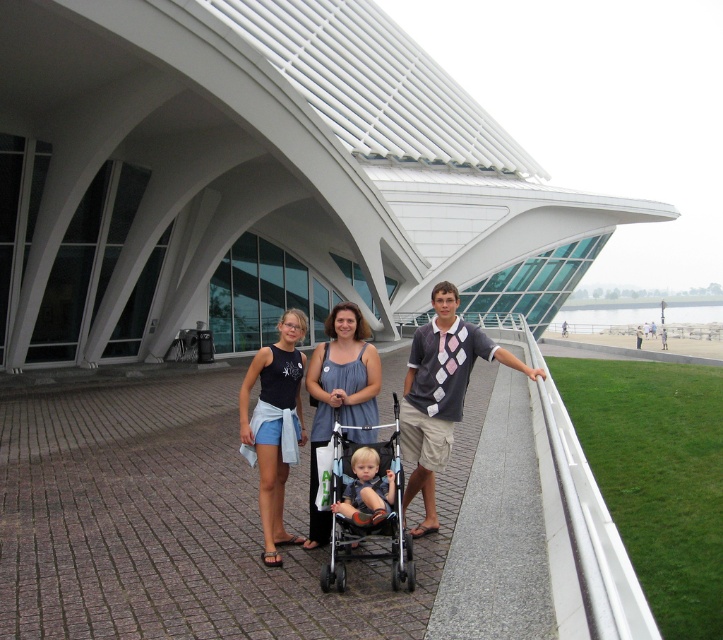
Is argyle-patterned shirt at center to the right of light brown fabric stroller at center from the viewer's perspective?

Correct, you'll find argyle-patterned shirt at center to the right of light brown fabric stroller at center.

Does argyle-patterned shirt at center appear over light brown fabric stroller at center?

Yes.

Find the location of a particular element. The image size is (723, 640). argyle-patterned shirt at center is located at coordinates (440, 392).

In order to click on argyle-patterned shirt at center in this screenshot , I will do `click(440, 392)`.

Which is behind, point (282, 531) or point (346, 500)?

Point (282, 531)

Measure the distance between black fabric tank top at center and camera.

black fabric tank top at center and camera are 15.72 feet apart.

Image resolution: width=723 pixels, height=640 pixels. What do you see at coordinates (273, 426) in the screenshot?
I see `black fabric tank top at center` at bounding box center [273, 426].

Identify the location of black fabric tank top at center. click(273, 426).

Does black fabric tank top at center appear on the left side of denim blue tank top at center?

Correct, you'll find black fabric tank top at center to the left of denim blue tank top at center.

Is point (282, 465) closer to viewer compared to point (354, 305)?

Yes, point (282, 465) is closer to viewer.

This screenshot has width=723, height=640. In order to click on black fabric tank top at center in this screenshot , I will do `click(273, 426)`.